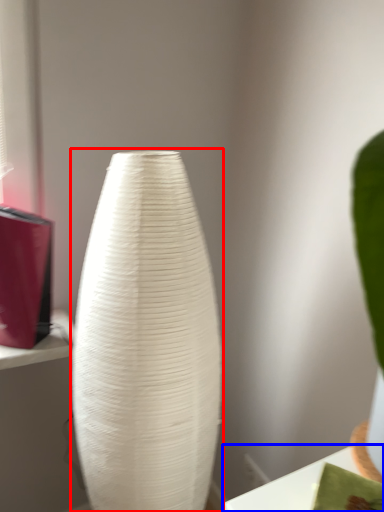
Question: Which of the following is the closest to the observer, vase (highlighted by a red box) or table (highlighted by a blue box)?

Choices:
 (A) vase
 (B) table

Answer: (B)